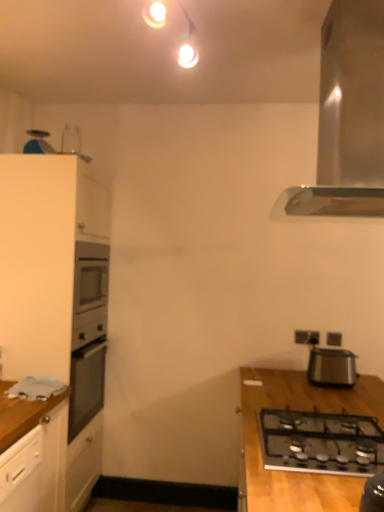
Question: Is white plastic electric outlet at upper right, placed as the 1th electric outlet when sorted from left to right, smaller than white matte cabinet at left?

Choices:
 (A) no
 (B) yes

Answer: (B)

Question: From the image's perspective, is white plastic electric outlet at upper right, placed as the 1th electric outlet when sorted from left to right, located above white matte cabinet at left?

Choices:
 (A) yes
 (B) no

Answer: (B)

Question: Does white plastic electric outlet at upper right, placed as the 1th electric outlet when sorted from left to right, lie in front of white matte cabinet at left?

Choices:
 (A) yes
 (B) no

Answer: (B)

Question: Is white plastic electric outlet at upper right, marked as the 2th electric outlet in a right-to-left arrangement, oriented away from white matte cabinet at left?

Choices:
 (A) yes
 (B) no

Answer: (B)

Question: Is white plastic electric outlet at upper right, placed as the 1th electric outlet when sorted from left to right, thinner than white matte cabinet at left?

Choices:
 (A) no
 (B) yes

Answer: (B)

Question: Considering their positions, is black plastic electric outlet at upper right, which is counted as the 2th electric outlet, starting from the left, located in front of or behind black plastic toaster at right?

Choices:
 (A) front
 (B) behind

Answer: (B)

Question: Does point (327, 337) appear closer or farther from the camera than point (345, 366)?

Choices:
 (A) farther
 (B) closer

Answer: (A)

Question: In terms of height, does black plastic electric outlet at upper right, arranged as the 1th electric outlet when viewed from the right, look taller or shorter compared to black plastic toaster at right?

Choices:
 (A) short
 (B) tall

Answer: (A)

Question: Would you say black plastic electric outlet at upper right, which is counted as the 2th electric outlet, starting from the left, is inside or outside black plastic toaster at right?

Choices:
 (A) outside
 (B) inside

Answer: (A)

Question: Is black plastic toaster at right spatially inside black glass gas stove at lower right, or outside of it?

Choices:
 (A) inside
 (B) outside

Answer: (B)

Question: Is point (324, 377) closer or farther from the camera than point (354, 444)?

Choices:
 (A) farther
 (B) closer

Answer: (A)

Question: In terms of width, does black plastic toaster at right look wider or thinner when compared to black glass gas stove at lower right?

Choices:
 (A) thin
 (B) wide

Answer: (A)

Question: In terms of height, does black plastic toaster at right look taller or shorter compared to black glass gas stove at lower right?

Choices:
 (A) tall
 (B) short

Answer: (A)

Question: Is white matte cabinet at left inside or outside of black plastic toaster at right?

Choices:
 (A) inside
 (B) outside

Answer: (B)

Question: From their relative heights in the image, would you say white matte cabinet at left is taller or shorter than black plastic toaster at right?

Choices:
 (A) tall
 (B) short

Answer: (A)